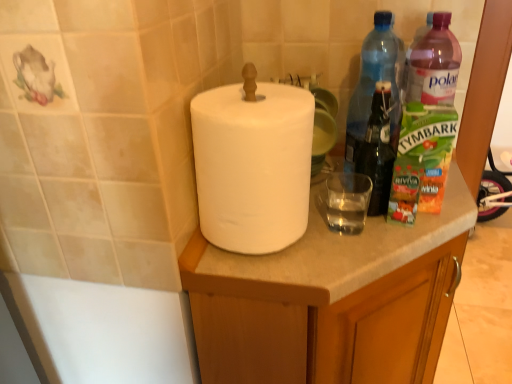
Question: Is white matte cabinet at center taller than transparent plastic bottle at upper right, the second bottle in the right-to-left sequence?

Choices:
 (A) no
 (B) yes

Answer: (B)

Question: Considering the relative sizes of white matte cabinet at center and transparent plastic bottle at upper right, the second bottle in the right-to-left sequence, in the image provided, is white matte cabinet at center smaller than transparent plastic bottle at upper right, the second bottle in the right-to-left sequence,?

Choices:
 (A) no
 (B) yes

Answer: (A)

Question: Would you say white matte cabinet at center is a long distance from transparent plastic bottle at upper right, the second bottle in the right-to-left sequence?

Choices:
 (A) no
 (B) yes

Answer: (A)

Question: Considering the relative sizes of white matte cabinet at center and transparent plastic bottle at upper right, arranged as the 1th bottle when viewed from the left, in the image provided, is white matte cabinet at center wider than transparent plastic bottle at upper right, arranged as the 1th bottle when viewed from the left,?

Choices:
 (A) yes
 (B) no

Answer: (A)

Question: Is white matte cabinet at center positioned in front of transparent plastic bottle at upper right, arranged as the 1th bottle when viewed from the left?

Choices:
 (A) no
 (B) yes

Answer: (B)

Question: Considering their positions, is white matte cabinet at center located in front of or behind transparent plastic bottle at upper right, arranged as the 1th bottle when viewed from the left?

Choices:
 (A) behind
 (B) front

Answer: (B)

Question: Does point pyautogui.click(x=262, y=349) appear closer or farther from the camera than point pyautogui.click(x=376, y=11)?

Choices:
 (A) closer
 (B) farther

Answer: (A)

Question: From their relative heights in the image, would you say white matte cabinet at center is taller or shorter than transparent plastic bottle at upper right, the second bottle in the right-to-left sequence?

Choices:
 (A) short
 (B) tall

Answer: (B)

Question: Visually, is white matte cabinet at center positioned to the left or to the right of transparent plastic bottle at upper right, the second bottle in the right-to-left sequence?

Choices:
 (A) right
 (B) left

Answer: (B)

Question: From the image's perspective, relative to white matte paper towel at center, is transparent glass at center above or below?

Choices:
 (A) above
 (B) below

Answer: (B)

Question: Is transparent glass at center taller or shorter than white matte paper towel at center?

Choices:
 (A) short
 (B) tall

Answer: (A)

Question: Choose the correct answer: Is transparent glass at center inside white matte paper towel at center or outside it?

Choices:
 (A) outside
 (B) inside

Answer: (A)

Question: Is point 356,173 positioned closer to the camera than point 210,205?

Choices:
 (A) farther
 (B) closer

Answer: (A)

Question: In terms of width, does white matte cabinet at center look wider or thinner when compared to pink plastic bottle at right, arranged as the first bottle when viewed from the right?

Choices:
 (A) thin
 (B) wide

Answer: (B)

Question: Is point (312, 248) closer or farther from the camera than point (410, 104)?

Choices:
 (A) farther
 (B) closer

Answer: (B)